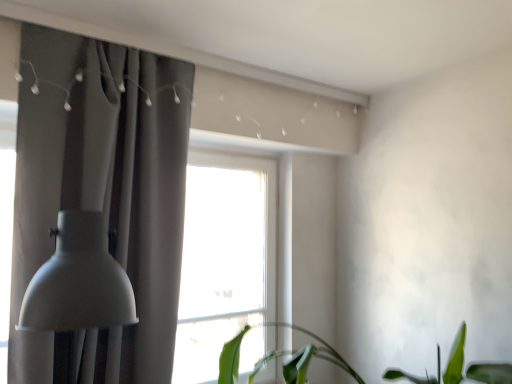
Question: From the image's perspective, is matte gray curtain at left above matte gray lampshade at left?

Choices:
 (A) no
 (B) yes

Answer: (B)

Question: Is matte gray curtain at left positioned beyond the bounds of matte gray lampshade at left?

Choices:
 (A) no
 (B) yes

Answer: (B)

Question: From a real-world perspective, is matte gray curtain at left beneath matte gray lampshade at left?

Choices:
 (A) no
 (B) yes

Answer: (A)

Question: Considering the relative sizes of matte gray curtain at left and matte gray lampshade at left in the image provided, is matte gray curtain at left shorter than matte gray lampshade at left?

Choices:
 (A) yes
 (B) no

Answer: (B)

Question: Are matte gray curtain at left and matte gray lampshade at left making contact?

Choices:
 (A) no
 (B) yes

Answer: (A)

Question: Is matte gray curtain at left to the left of matte gray lampshade at left from the viewer's perspective?

Choices:
 (A) yes
 (B) no

Answer: (B)

Question: From a real-world perspective, is matte gray curtain at left physically above green leafy plant at lower center?

Choices:
 (A) no
 (B) yes

Answer: (B)

Question: Does matte gray curtain at left have a greater width compared to green leafy plant at lower center?

Choices:
 (A) yes
 (B) no

Answer: (B)

Question: Are matte gray curtain at left and green leafy plant at lower center located far from each other?

Choices:
 (A) yes
 (B) no

Answer: (B)

Question: Can you confirm if matte gray curtain at left is positioned to the left of green leafy plant at lower center?

Choices:
 (A) no
 (B) yes

Answer: (B)

Question: Is matte gray curtain at left looking in the opposite direction of green leafy plant at lower center?

Choices:
 (A) no
 (B) yes

Answer: (A)

Question: From the image's perspective, is matte gray curtain at left located beneath green leafy plant at lower center?

Choices:
 (A) yes
 (B) no

Answer: (B)

Question: From a real-world perspective, is green leafy plant at lower center physically below matte gray curtain at left?

Choices:
 (A) yes
 (B) no

Answer: (A)